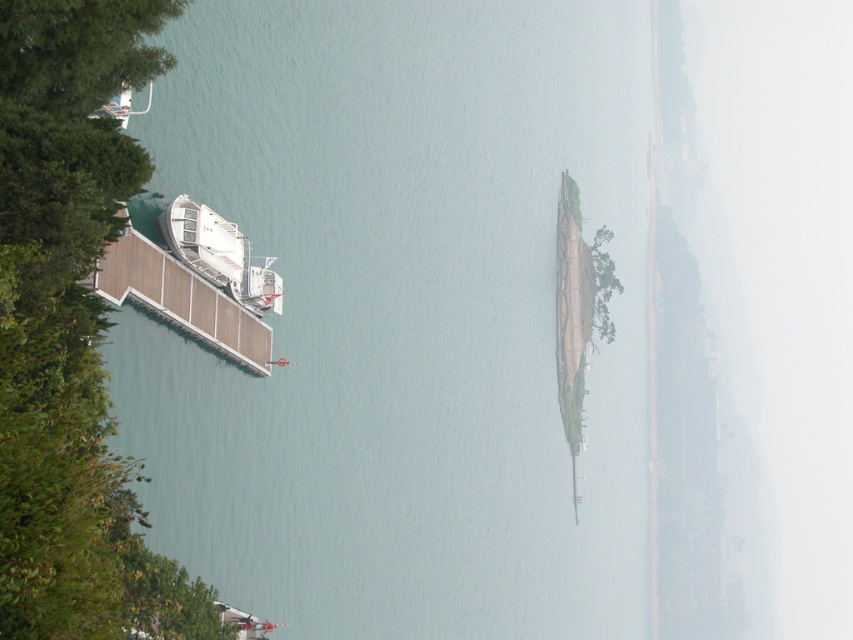
You are a sailor trying to navigate a narrow channel between the clear blue water at left and the white glossy boat at left. Which direction should you steer your boat to avoid collision?

The clear blue water at left is positioned on the right side of white glossy boat at left, so you should steer your boat to the left to avoid collision with the white glossy boat at left and navigate through the clear blue water at left.

You are a tour guide on the white glossy boat at left and need to reach the white glossy boat at upper left to pick up passengers. Can you safely maneuver your boat to the other boat within 10 meters of distance?

The distance between the white glossy boat at left and the white glossy boat at upper left is 8.24 meters, so yes, you can safely maneuver your boat to the other boat within 10 meters of distance.